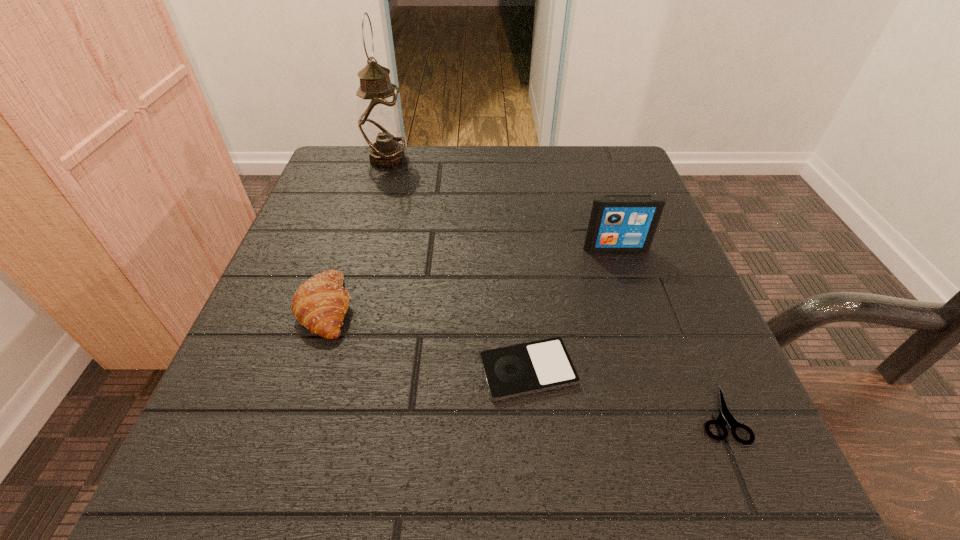
Image resolution: width=960 pixels, height=540 pixels. I want to click on object situated at the near right corner, so click(725, 416).

At what (x,y) coordinates should I click in order to perform the action: click on vacant space at the far edge. Please return your answer as a coordinate pair (x, y). The image size is (960, 540). Looking at the image, I should click on click(452, 162).

Where is `vacant space at the near edge of the desktop`? The height and width of the screenshot is (540, 960). vacant space at the near edge of the desktop is located at coordinates (626, 480).

The image size is (960, 540). What are the coordinates of `free space at the left edge` in the screenshot? It's located at (355, 291).

Identify the location of free space at the right edge of the desktop. The image size is (960, 540). (668, 278).

I want to click on blank space at the far left corner of the desktop, so click(360, 157).

What are the coordinates of `empty space between the farthest object and the shears` in the screenshot? It's located at (554, 287).

You are a GUI agent. You are given a task and a screenshot of the screen. Output one action in this format:
    pyautogui.click(x=<x>, y=<y>)
    Task: Click on the empty space that is in between the oil lamp and the shorter iPod
    
    Given the screenshot: What is the action you would take?
    pyautogui.click(x=458, y=265)

In order to click on vacant area that lies between the third tallest object and the nearer iPod in this screenshot , I will do `click(427, 339)`.

Find the location of a particular element. The width and height of the screenshot is (960, 540). vacant space that's between the crescent roll and the second shortest object is located at coordinates (427, 339).